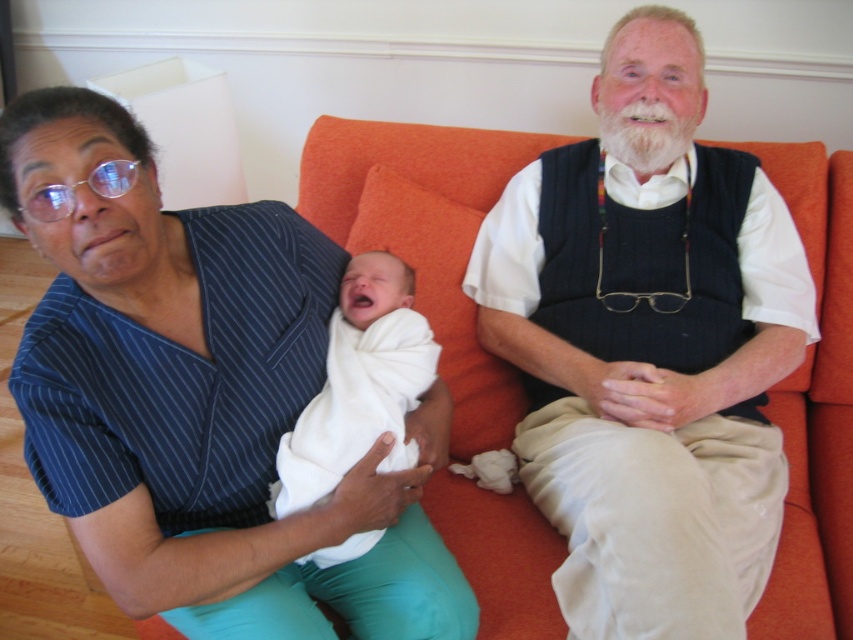
Can you confirm if blue striped shirt at upper left is shorter than white soft swaddle at center?

Incorrect, blue striped shirt at upper left's height does not fall short of white soft swaddle at center's.

Which of these two, blue striped shirt at upper left or white soft swaddle at center, stands shorter?

Standing shorter between the two is white soft swaddle at center.

Is point (317, 624) behind point (405, 282)?

No, it is in front of (405, 282).

At what (x,y) coordinates should I click in order to perform the action: click on blue striped shirt at upper left. Please return your answer as a coordinate pair (x, y). Image resolution: width=853 pixels, height=640 pixels. Looking at the image, I should click on (201, 400).

Between point (80, 122) and point (712, 445), which one is positioned in front?

Positioned in front is point (80, 122).

Does blue striped shirt at upper left lie behind white knit vest at center?

That is False.

Find the location of a particular element. The width and height of the screenshot is (853, 640). blue striped shirt at upper left is located at coordinates (201, 400).

Where is `blue striped shirt at upper left`? The width and height of the screenshot is (853, 640). blue striped shirt at upper left is located at coordinates coord(201,400).

Based on the photo, does white knit vest at center have a greater height compared to white soft swaddle at center?

Yes.

This screenshot has height=640, width=853. I want to click on white knit vest at center, so click(648, 348).